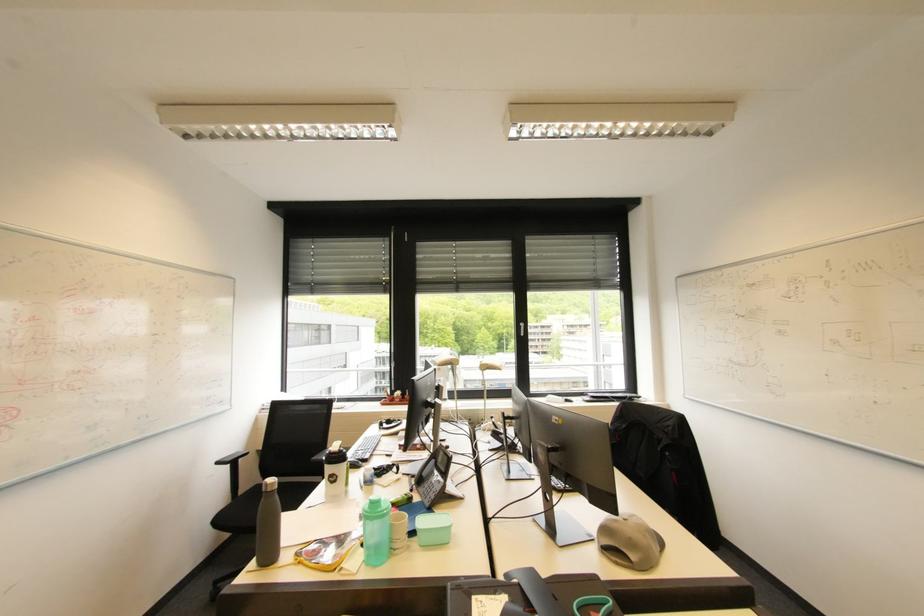
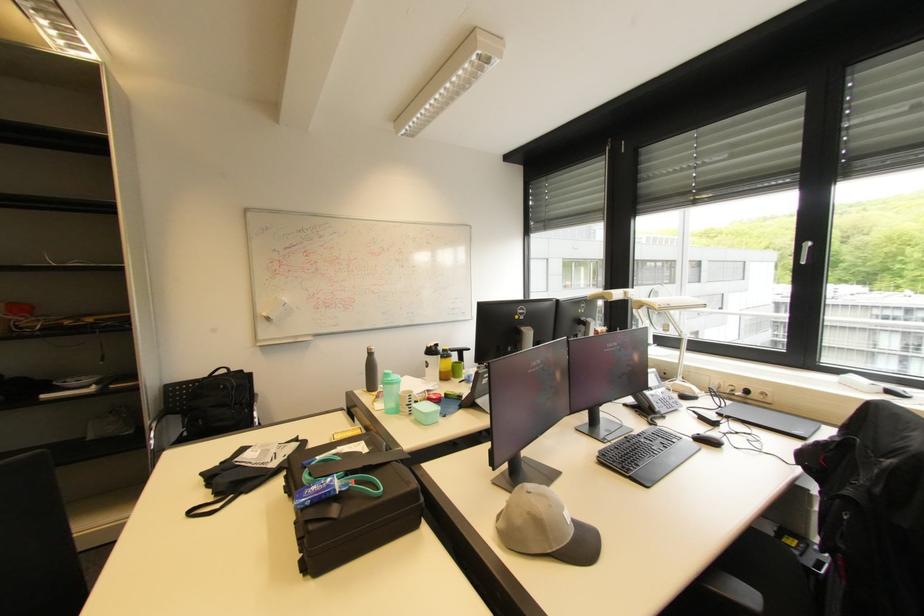
Find the pixel in the second image that matches point (386, 507) in the first image.

(394, 379)